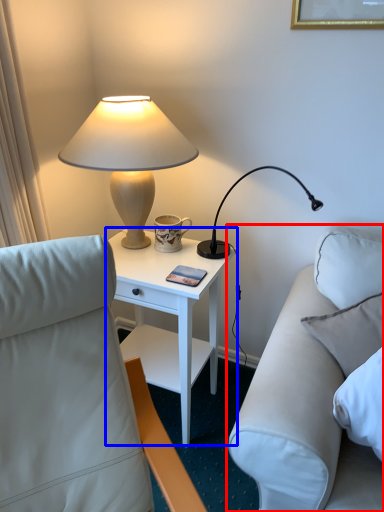
Question: Which of the following is the farthest to the observer, studio couch (highlighted by a red box) or nightstand (highlighted by a blue box)?

Choices:
 (A) studio couch
 (B) nightstand

Answer: (B)